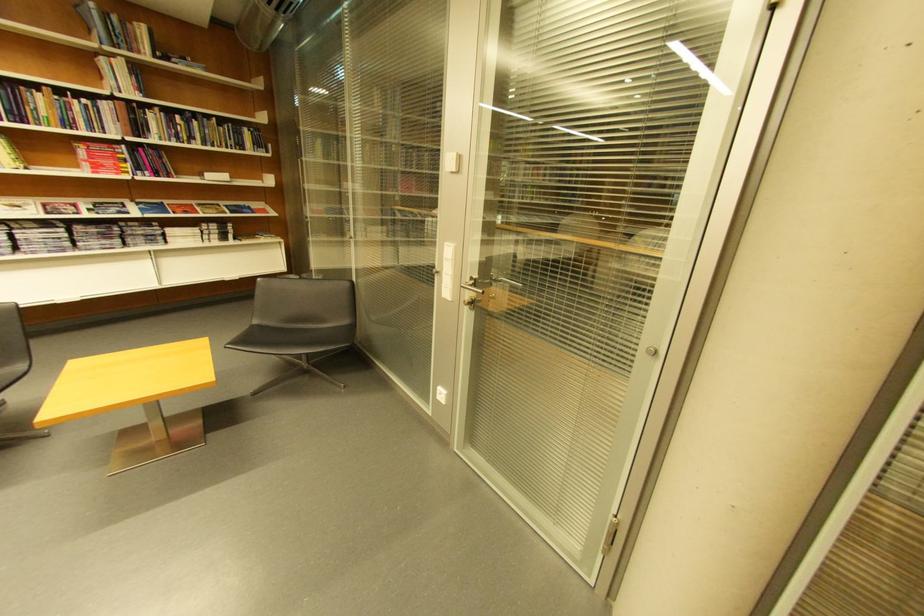
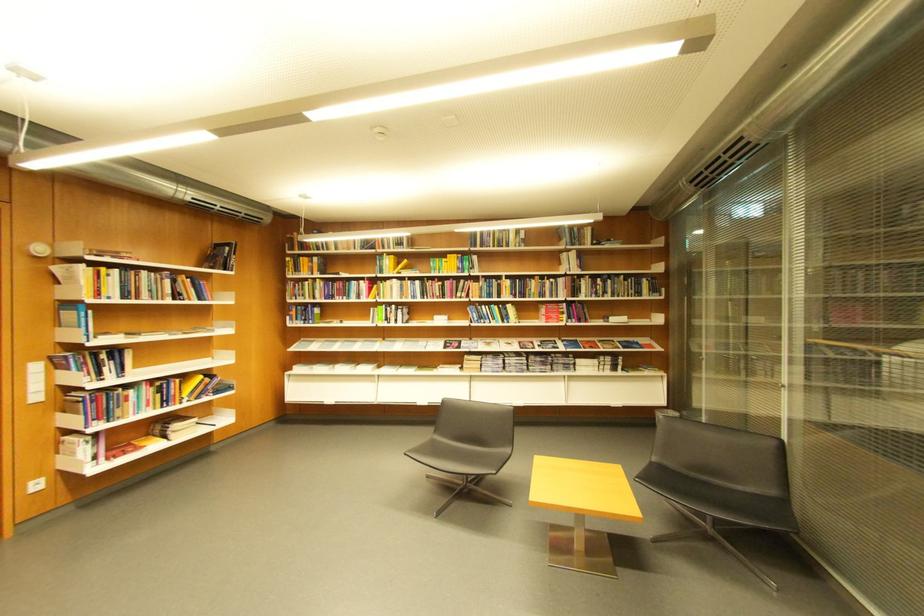
Question: The camera is either moving clockwise (left) or counter-clockwise (right) around the object. The first image is from the beginning of the video and the second image is from the end. Is the camera moving left or right when shooting the video?

Choices:
 (A) Left
 (B) Right

Answer: (B)